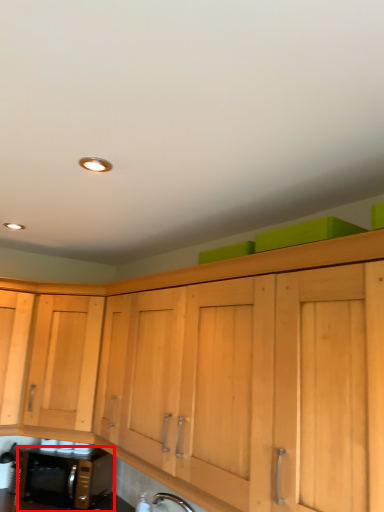
Question: In this image, where is microwave oven (annotated by the red box) located relative to cabinetry?

Choices:
 (A) left
 (B) right

Answer: (A)